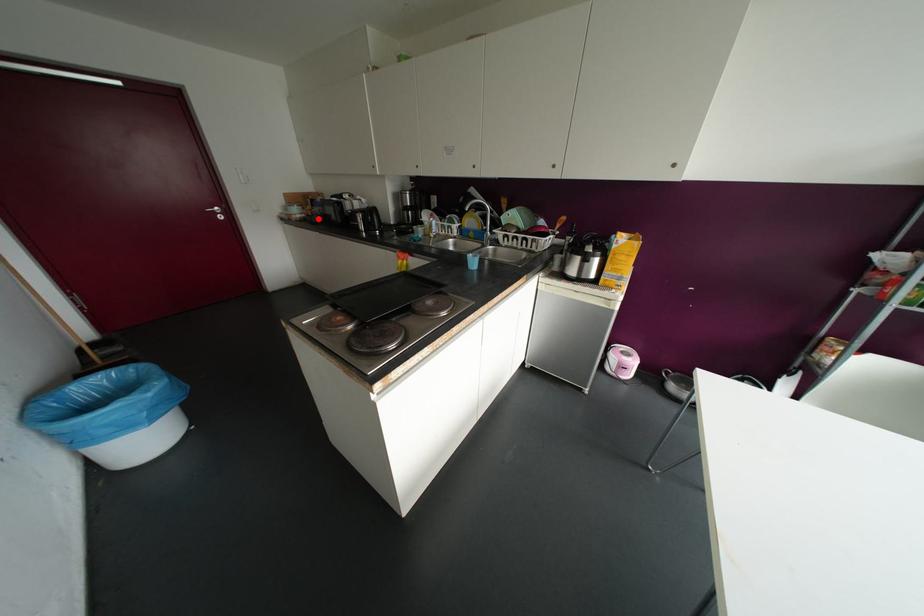
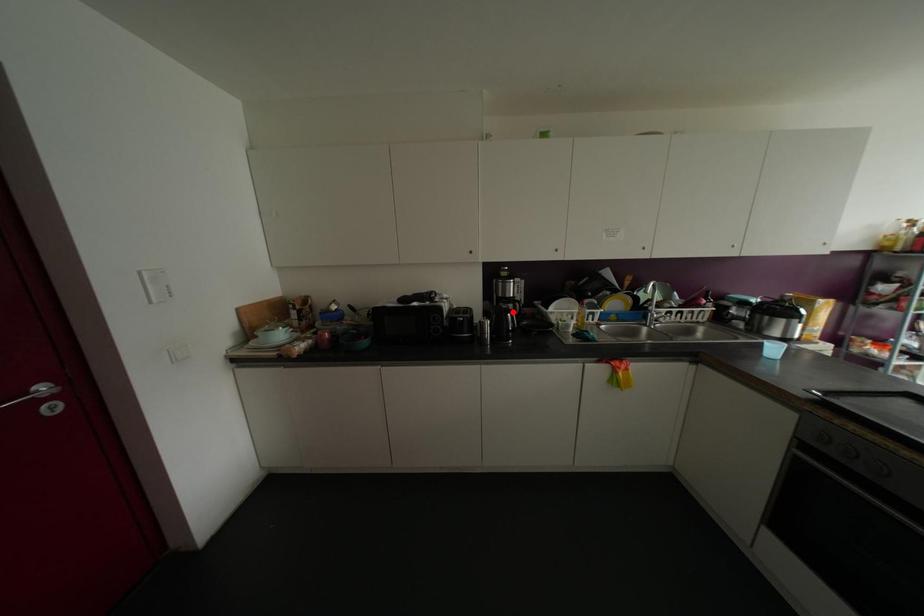
I am providing you with two images of the same scene from different viewpoints. A red point is marked on the first image and another point is marked on the second image. Is the marked point in image1 the same physical position as the marked point in image2?

No